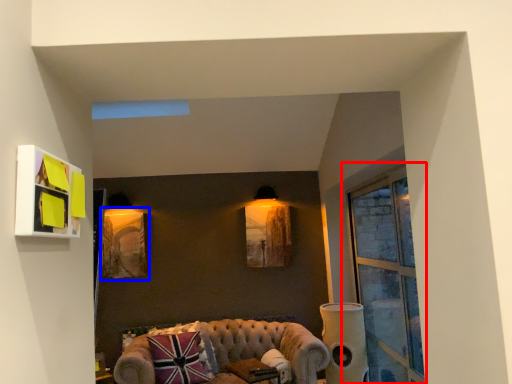
Question: Among these objects, which one is farthest to the camera, window (highlighted by a red box) or picture frame (highlighted by a blue box)?

Choices:
 (A) window
 (B) picture frame

Answer: (B)